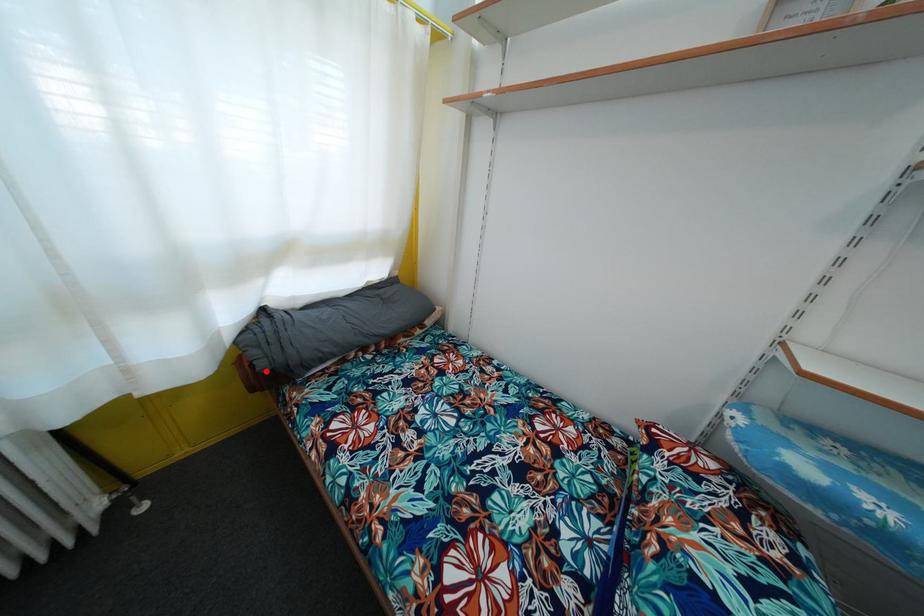
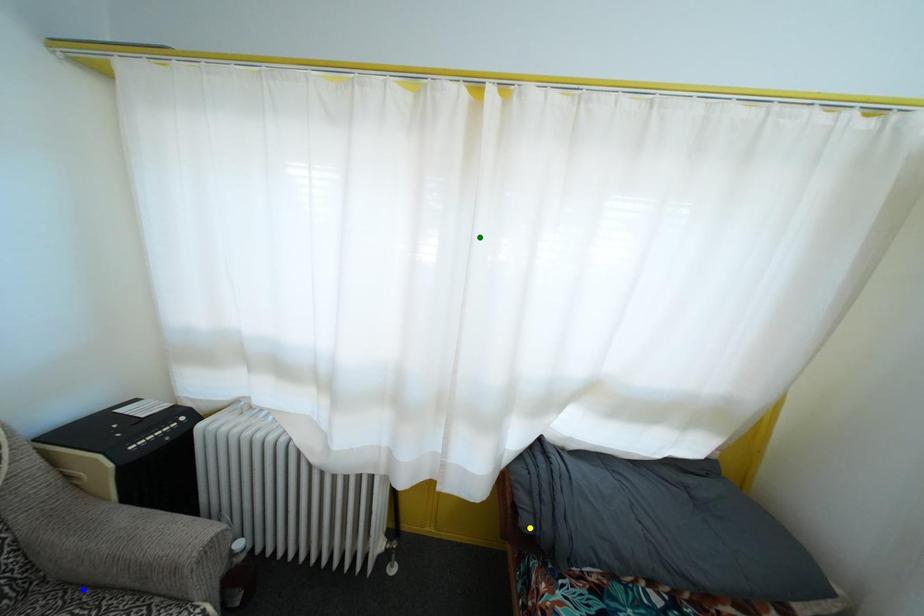
Question: I am providing you with two images of the same scene from different viewpoints. A red point is marked on the first image. You are given multiple points on the second image. Can you choose the point in image 2 that corresponds to the point in image 1?

Choices:
 (A) yellow point
 (B) blue point
 (C) green point

Answer: (A)